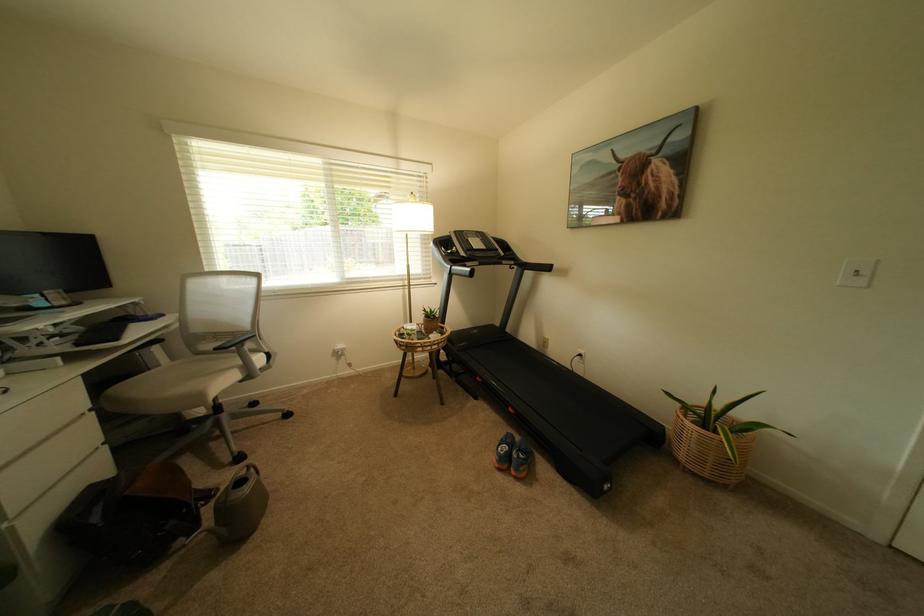
Find the location of `grey watering can`. grey watering can is located at coordinates (239, 505).